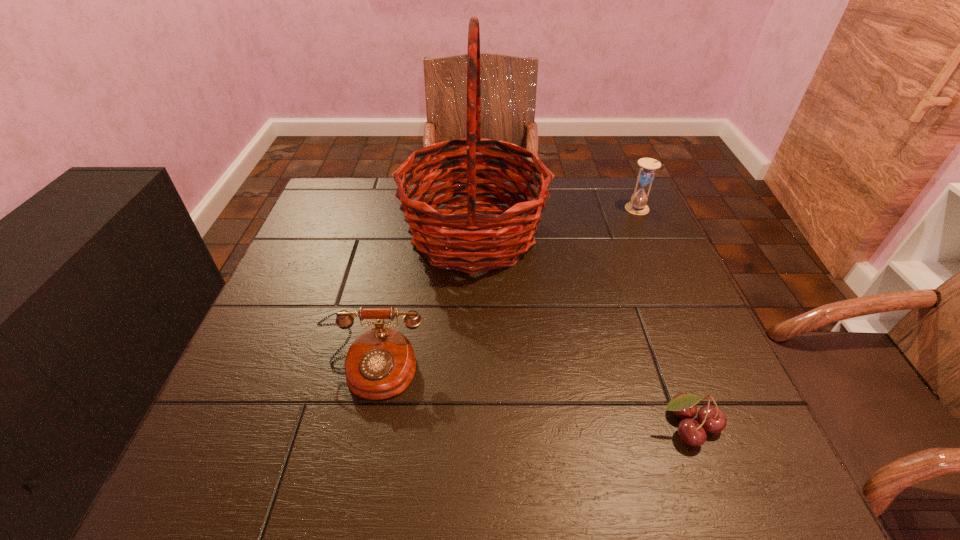
Find the location of `basket at the far edge`. basket at the far edge is located at coordinates (452, 234).

Locate an element on the screen. The width and height of the screenshot is (960, 540). hourglass that is positioned at the far edge is located at coordinates 646,174.

The width and height of the screenshot is (960, 540). I want to click on object that is at the near edge, so click(712, 419).

This screenshot has width=960, height=540. I want to click on hourglass present at the right edge, so click(646, 174).

I want to click on cherry at the right edge, so [x=712, y=419].

Identify the location of object located at the far right corner. (646, 174).

Where is `object at the near right corner`? This screenshot has width=960, height=540. object at the near right corner is located at coordinates (712, 419).

The height and width of the screenshot is (540, 960). In order to click on free spot at the far edge of the desktop in this screenshot , I will do `click(391, 195)`.

The width and height of the screenshot is (960, 540). What are the coordinates of `vacant space at the near edge of the desktop` in the screenshot? It's located at (654, 453).

Where is `vacant space at the left edge of the desktop`? The width and height of the screenshot is (960, 540). vacant space at the left edge of the desktop is located at coordinates (332, 253).